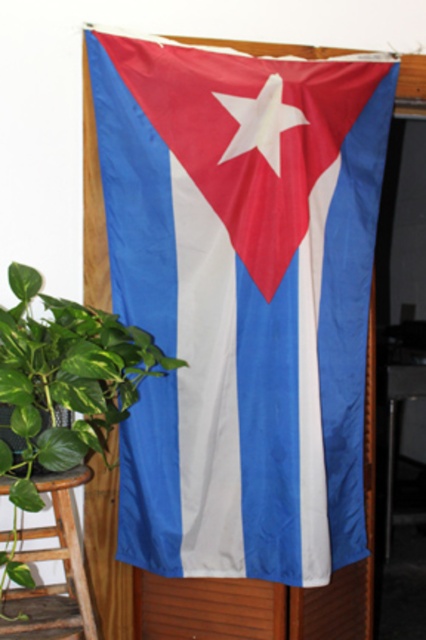
You are an interior designer planning to hang a new painting on the wall behind the textured fabric flag at center. The painting is 1 meter wide and needs to be centered exactly where the flag is currently hanging. Given the flag is at coordinates 0.470, 0.568, will the painting fit perfectly without overlapping the flag? Please explain using the flag and painting dimensions.

The painting is 1 meter wide and needs to be centered at the same coordinates as the textured fabric flag at center, which is at point (241, 300). However, the flag itself has a width that occupies space at that location. Without knowing the flag dimensions, we cannot confirm if the painting will overlap. The question lacks information about the flag size to determine fit.

Looking at this image, you are setting up a display and need to ensure the textured fabric flag at center can be seen over the wooden stool at lower left. Based on their heights, will the flag be visible above the stool?

The textured fabric flag at center has a greater height compared to wooden stool at lower left, so yes, the flag will be visible above the stool.

You are an interior designer planning to place a decorative item next to the green leafy plant at left. Considering the size of the textured fabric flag at center, which is larger, would you recommend placing a small or large item to maintain visual balance?

Since the textured fabric flag at center is bigger than the green leafy plant at left, placing a larger decorative item next to the green leafy plant at left would help balance the composition by counteracting the size difference between the two objects.